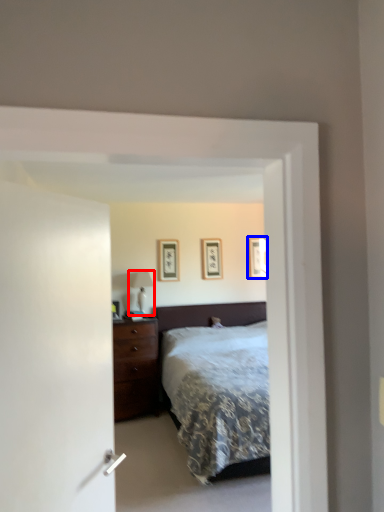
Question: Which object appears farthest to the camera in this image, table lamp (highlighted by a red box) or picture frame (highlighted by a blue box)?

Choices:
 (A) table lamp
 (B) picture frame

Answer: (B)